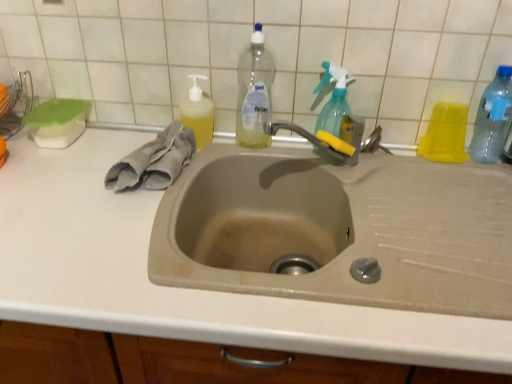
Question: From a real-world perspective, is yellow rubber tap at upper center physically below yellow translucent liquid at upper left, marked as the first cleaning product in a left-to-right arrangement?

Choices:
 (A) yes
 (B) no

Answer: (A)

Question: Can you confirm if yellow rubber tap at upper center is bigger than yellow translucent liquid at upper left, which is the second cleaning product in right-to-left order?

Choices:
 (A) no
 (B) yes

Answer: (A)

Question: From a real-world perspective, is yellow rubber tap at upper center positioned over yellow translucent liquid at upper left, which is the second cleaning product in right-to-left order, based on gravity?

Choices:
 (A) no
 (B) yes

Answer: (A)

Question: Does yellow rubber tap at upper center turn towards yellow translucent liquid at upper left, marked as the first cleaning product in a left-to-right arrangement?

Choices:
 (A) yes
 (B) no

Answer: (B)

Question: From the image's perspective, is yellow rubber tap at upper center above yellow translucent liquid at upper left, marked as the first cleaning product in a left-to-right arrangement?

Choices:
 (A) no
 (B) yes

Answer: (A)

Question: From the image's perspective, is transparent plastic spray bottle at upper right, the second cleaning product from the left, positioned above or below transparent plastic bottle at right, the third bottle when ordered from left to right?

Choices:
 (A) below
 (B) above

Answer: (B)

Question: In the image, is transparent plastic spray bottle at upper right, which is counted as the first cleaning product, starting from the right, positioned in front of or behind transparent plastic bottle at right, the third bottle when ordered from left to right?

Choices:
 (A) behind
 (B) front

Answer: (A)

Question: Considering the positions of point pos(342,135) and point pos(480,107), is point pos(342,135) closer or farther from the camera than point pos(480,107)?

Choices:
 (A) farther
 (B) closer

Answer: (B)

Question: Is transparent plastic spray bottle at upper right, the second cleaning product from the left, wider or thinner than transparent plastic bottle at right, which appears as the first bottle when viewed from the right?

Choices:
 (A) thin
 (B) wide

Answer: (A)

Question: Considering the positions of beige matte sink at center and transparent plastic spray bottle at upper right, which is counted as the first cleaning product, starting from the right, in the image, is beige matte sink at center taller or shorter than transparent plastic spray bottle at upper right, which is counted as the first cleaning product, starting from the right,?

Choices:
 (A) short
 (B) tall

Answer: (B)

Question: Relative to transparent plastic spray bottle at upper right, which is counted as the first cleaning product, starting from the right, is beige matte sink at center in front or behind?

Choices:
 (A) front
 (B) behind

Answer: (A)

Question: Based on their sizes in the image, would you say beige matte sink at center is bigger or smaller than transparent plastic spray bottle at upper right, the second cleaning product from the left?

Choices:
 (A) big
 (B) small

Answer: (A)

Question: In the image, is beige matte sink at center on the left side or the right side of transparent plastic spray bottle at upper right, the second cleaning product from the left?

Choices:
 (A) right
 (B) left

Answer: (A)

Question: Is clear plastic bottle at upper center, which is the 1th bottle from left to right, to the left or to the right of yellow rubber tap at upper center in the image?

Choices:
 (A) right
 (B) left

Answer: (B)

Question: Considering the positions of clear plastic bottle at upper center, which is the 1th bottle from left to right, and yellow rubber tap at upper center in the image, is clear plastic bottle at upper center, which is the 1th bottle from left to right, bigger or smaller than yellow rubber tap at upper center?

Choices:
 (A) big
 (B) small

Answer: (A)